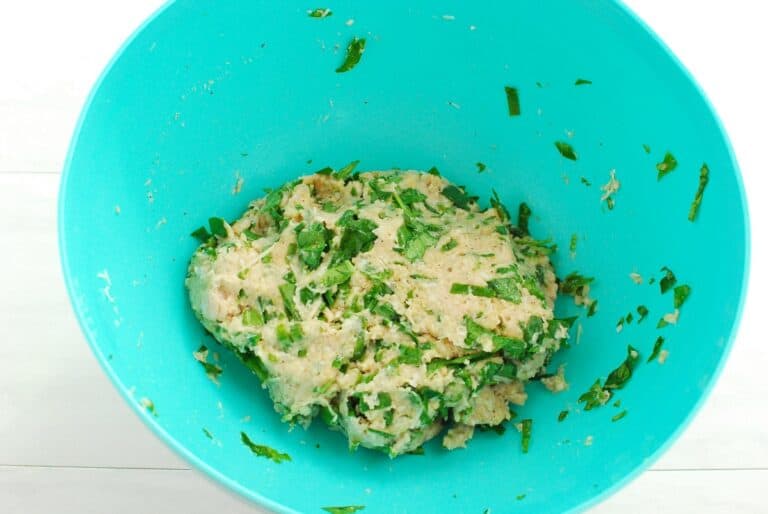
The height and width of the screenshot is (514, 768). What are the coordinates of `right rim of the blue bowl` in the screenshot? It's located at coord(746,236).